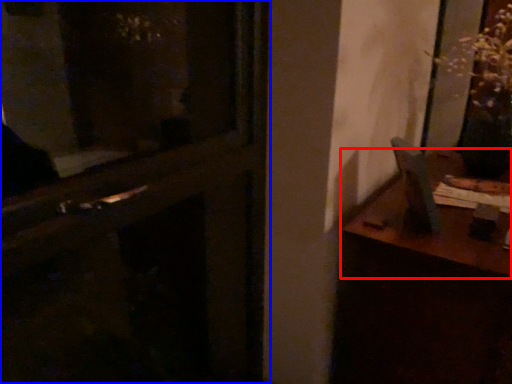
Question: Which object appears farthest to the camera in this image, table (highlighted by a red box) or door (highlighted by a blue box)?

Choices:
 (A) table
 (B) door

Answer: (A)